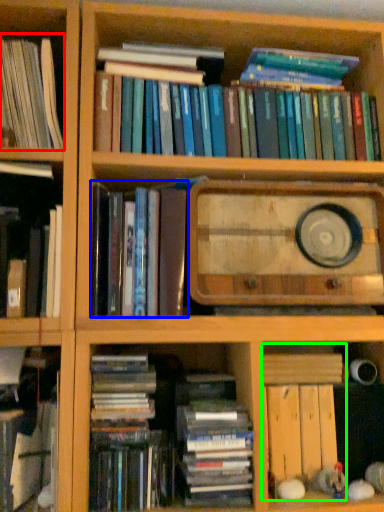
Question: Considering the real-world distances, which object is closest to book (highlighted by a red box)? book (highlighted by a blue box) or book (highlighted by a green box).

Choices:
 (A) book
 (B) book

Answer: (A)